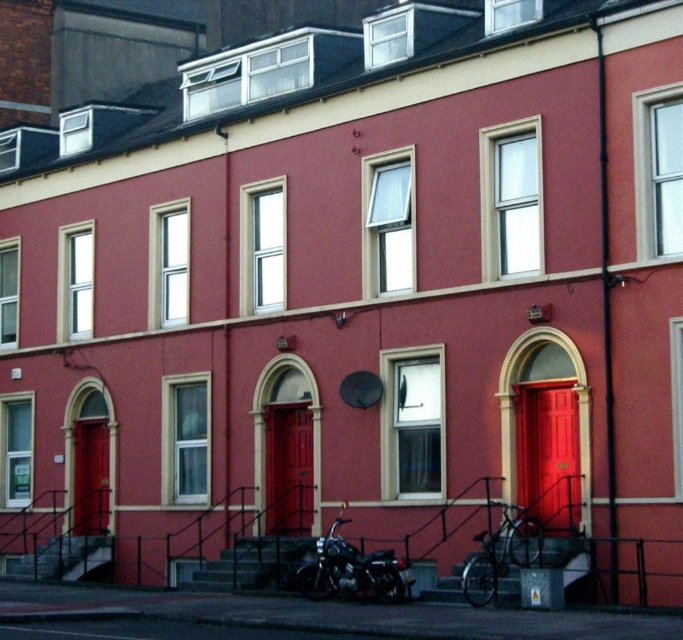
Question: Can you confirm if matte red door at center right is positioned to the left of matte red door at center?

Choices:
 (A) no
 (B) yes

Answer: (A)

Question: Estimate the real-world distances between objects in this image. Which object is farther from the matte red door at center?

Choices:
 (A) matte red door at lower left
 (B) matte red door at center right

Answer: (A)

Question: Based on their relative distances, which object is farther from the matte red door at center right?

Choices:
 (A) shiny black motorcycle at center
 (B) matte red door at center

Answer: (B)

Question: Is matte red door at center below shiny black motorcycle at center?

Choices:
 (A) no
 (B) yes

Answer: (A)

Question: Which object appears farthest from the camera in this image?

Choices:
 (A) matte red door at center
 (B) matte red door at center right
 (C) matte red door at lower left
 (D) shiny black motorcycle at center

Answer: (C)

Question: Is the position of shiny black motorcycle at center less distant than that of matte red door at lower left?

Choices:
 (A) yes
 (B) no

Answer: (A)